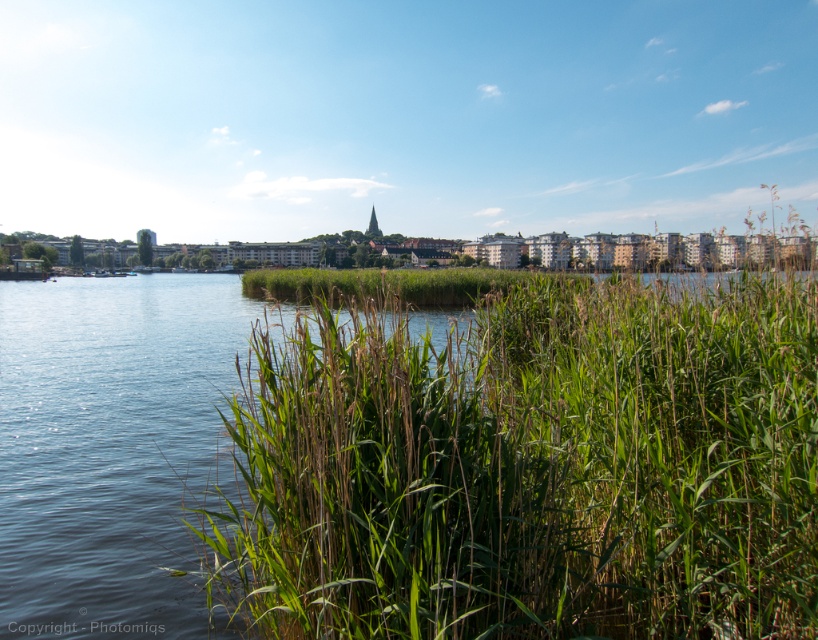
Does green leafy grass at center have a lesser width compared to green grassy river at center?

Yes, green leafy grass at center is thinner than green grassy river at center.

Is green leafy grass at center smaller than green grassy river at center?

Correct, green leafy grass at center occupies less space than green grassy river at center.

You are a GUI agent. You are given a task and a screenshot of the screen. Output one action in this format:
    pyautogui.click(x=<x>, y=<y>)
    Task: Click on the green leafy grass at center
    Image resolution: width=818 pixels, height=640 pixels.
    Given the screenshot: What is the action you would take?
    pyautogui.click(x=528, y=468)